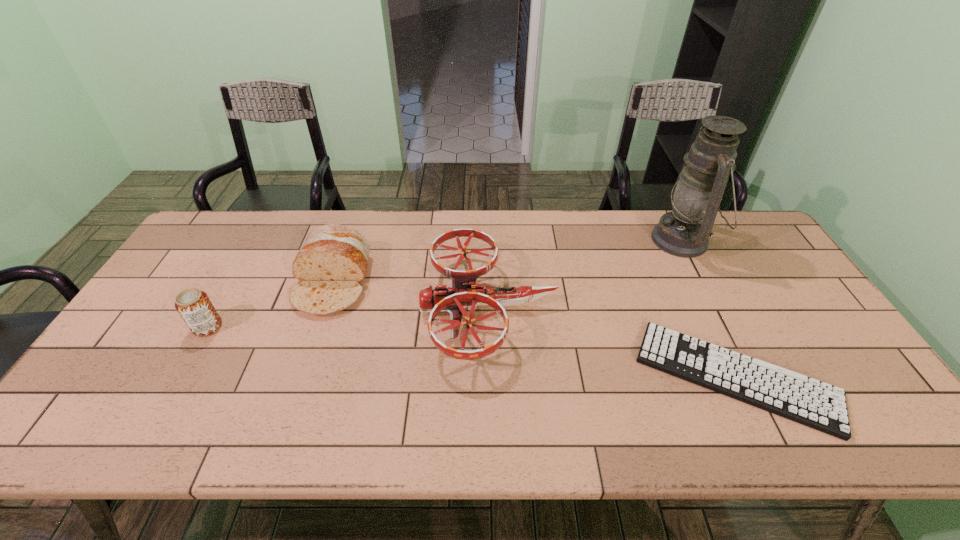
You are a GUI agent. You are given a task and a screenshot of the screen. Output one action in this format:
    pyautogui.click(x=<x>, y=<y>)
    Task: Click on the free space between the drone and the beer can
    The height and width of the screenshot is (540, 960).
    Given the screenshot: What is the action you would take?
    pyautogui.click(x=348, y=318)

Locate an element on the screen. The height and width of the screenshot is (540, 960). free space that is in between the third object from left to right and the leftmost object is located at coordinates (348, 318).

Where is `empty space between the oil lamp and the second object from left to right`? empty space between the oil lamp and the second object from left to right is located at coordinates (508, 261).

The width and height of the screenshot is (960, 540). Identify the location of vacant area between the tallest object and the leftmost object. (445, 284).

The width and height of the screenshot is (960, 540). In order to click on unoccupied position between the leftmost object and the drone in this screenshot , I will do `click(348, 318)`.

Locate an element on the screen. The width and height of the screenshot is (960, 540). vacant space in between the bread and the computer keyboard is located at coordinates (535, 329).

Identify the location of vacant region between the bread and the computer keyboard. This screenshot has height=540, width=960. (535, 329).

This screenshot has height=540, width=960. In order to click on vacant region between the drone and the tallest object in this screenshot , I will do `click(586, 274)`.

Image resolution: width=960 pixels, height=540 pixels. I want to click on free point between the third object from left to right and the shortest object, so click(612, 342).

Where is `the fourth closest object to the shortest object`? the fourth closest object to the shortest object is located at coordinates (194, 306).